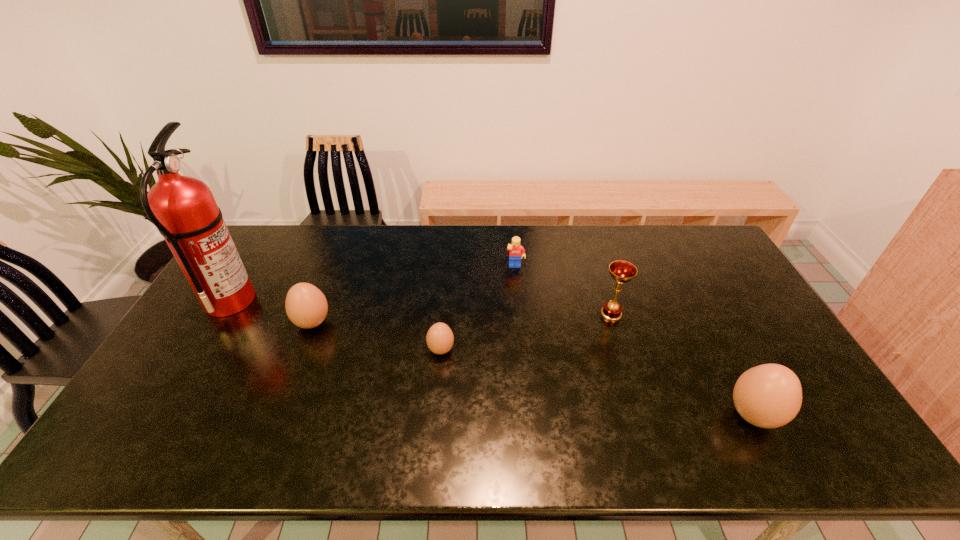
Locate an element on the screen. Image resolution: width=960 pixels, height=540 pixels. object that is positioned at the right edge is located at coordinates (769, 396).

I want to click on object present at the near right corner, so click(x=769, y=396).

At what (x,y) coordinates should I click in order to perform the action: click on vacant space at the far edge. Please return your answer as a coordinate pair (x, y). The height and width of the screenshot is (540, 960). Looking at the image, I should click on (666, 239).

Identify the location of vacant space at the near edge of the desktop. (458, 417).

At what (x,y) coordinates should I click in order to perform the action: click on vacant space at the left edge. Please return your answer as a coordinate pair (x, y). Looking at the image, I should click on (201, 321).

Locate an element on the screen. Image resolution: width=960 pixels, height=540 pixels. vacant position at the right edge of the desktop is located at coordinates (696, 276).

Find the location of `vacant space at the far left corner`. vacant space at the far left corner is located at coordinates [x=278, y=251].

This screenshot has height=540, width=960. Find the location of `blank area at the far right corner`. blank area at the far right corner is located at coordinates (702, 248).

You are a GUI agent. You are given a task and a screenshot of the screen. Output one action in this format:
    pyautogui.click(x=<x>, y=<y>)
    Task: Click on the vacant point located between the second nearest object and the Lego
    The height and width of the screenshot is (540, 960).
    Given the screenshot: What is the action you would take?
    tap(478, 308)

Image resolution: width=960 pixels, height=540 pixels. Find the location of `free space between the farthest object and the second nearest object`. free space between the farthest object and the second nearest object is located at coordinates (478, 308).